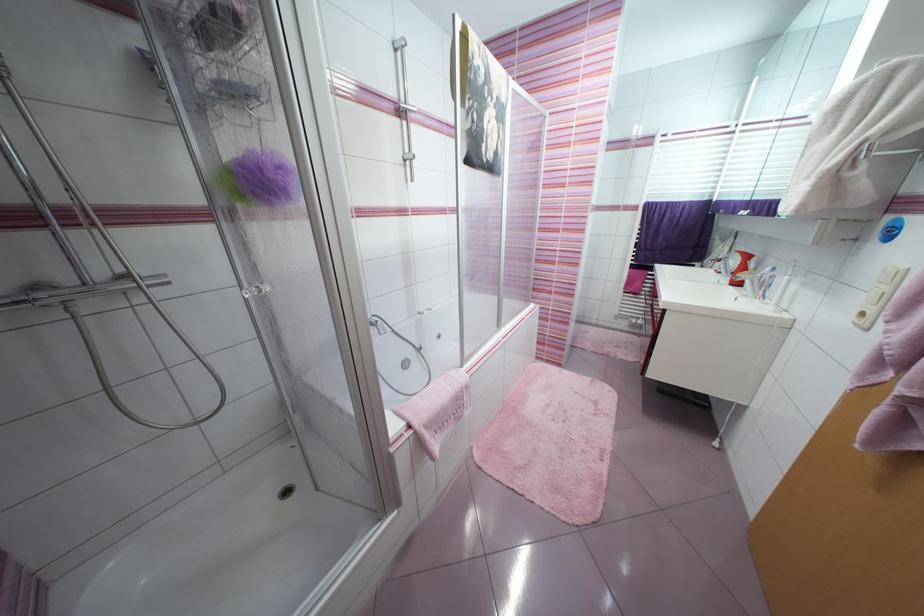
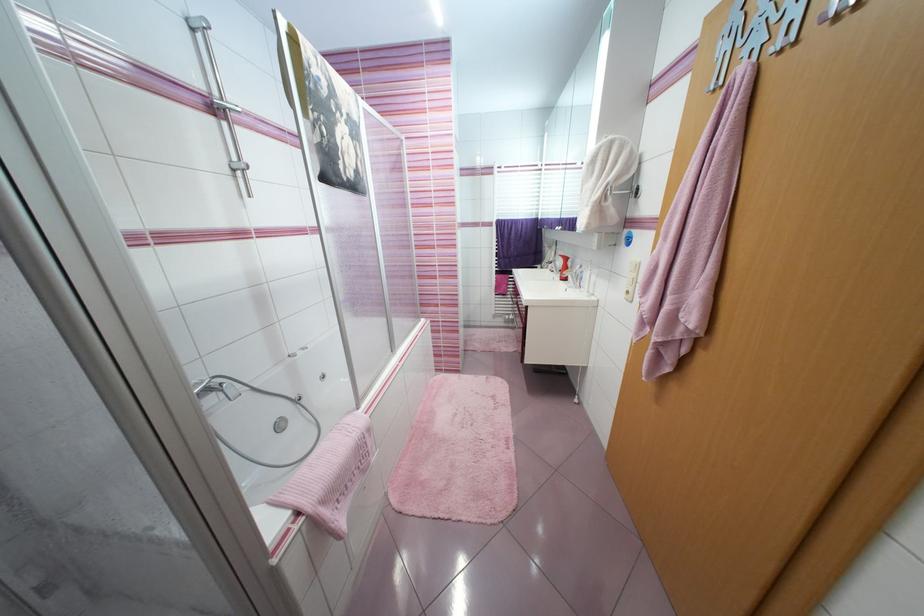
In the second image, find the point that corresponds to [736,262] in the first image.

(563, 264)